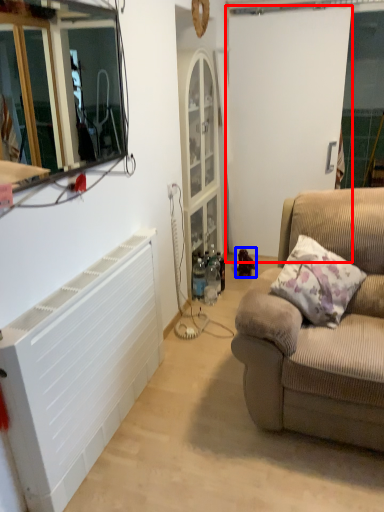
Question: Which of the following is the closest to the observer, screen door (highlighted by a red box) or toy (highlighted by a blue box)?

Choices:
 (A) screen door
 (B) toy

Answer: (A)